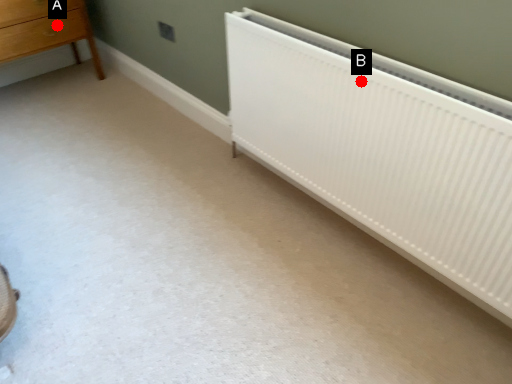
Question: Two points are circled on the image, labeled by A and B beside each circle. Which of the following is the closest to the observer?

Choices:
 (A) A is closer
 (B) B is closer

Answer: (B)